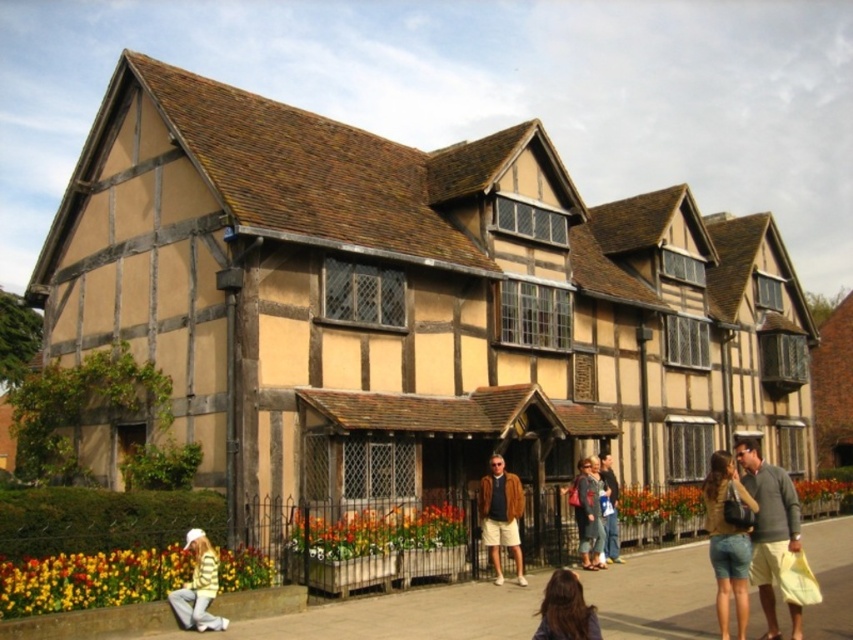
Question: Does paved concrete sidewalk at lower center appear over dark brown hair at lower center?

Choices:
 (A) yes
 (B) no

Answer: (B)

Question: Is light brown sweater at center thinner than light brown leather jacket at center?

Choices:
 (A) no
 (B) yes

Answer: (A)

Question: Which object appears closest to the camera in this image?

Choices:
 (A) paved concrete sidewalk at lower center
 (B) striped sweater at lower left
 (C) denim shorts at lower right

Answer: (A)

Question: Among these objects, which one is nearest to the camera?

Choices:
 (A) light brown sweater at center
 (B) brown fur coat at center
 (C) dark brown hair at lower center

Answer: (C)

Question: Is light brown sweater at center to the right of light brown leather jacket at center from the viewer's perspective?

Choices:
 (A) no
 (B) yes

Answer: (B)

Question: Which point is closer to the camera?

Choices:
 (A) light brown sweater at center
 (B) light brown leather jacket at center
 (C) striped sweater at lower left

Answer: (A)